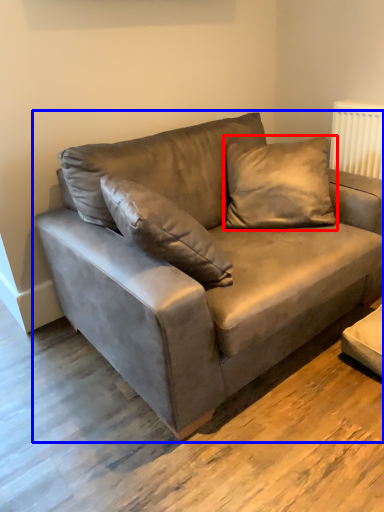
Question: Which object is closer to the camera taking this photo, pillow (highlighted by a red box) or studio couch (highlighted by a blue box)?

Choices:
 (A) pillow
 (B) studio couch

Answer: (B)